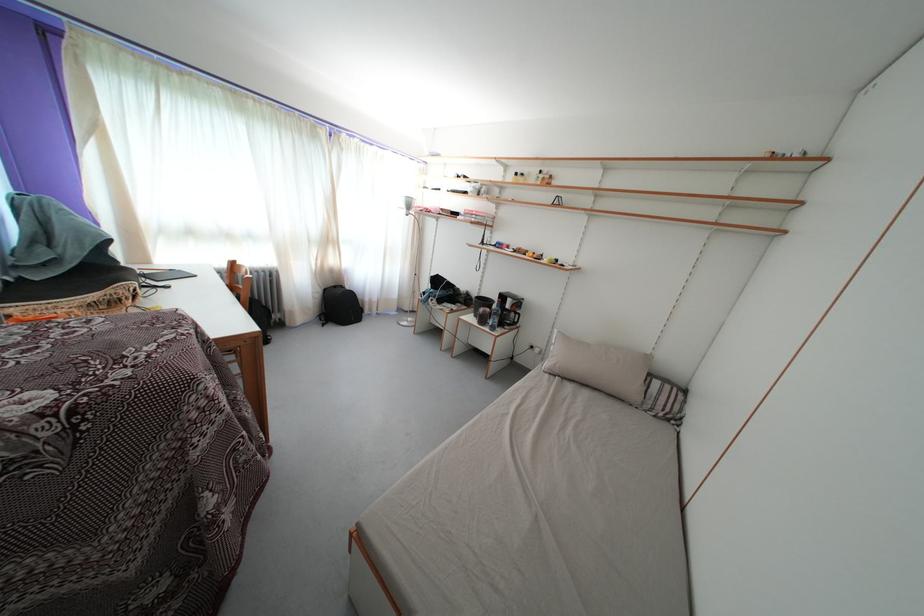
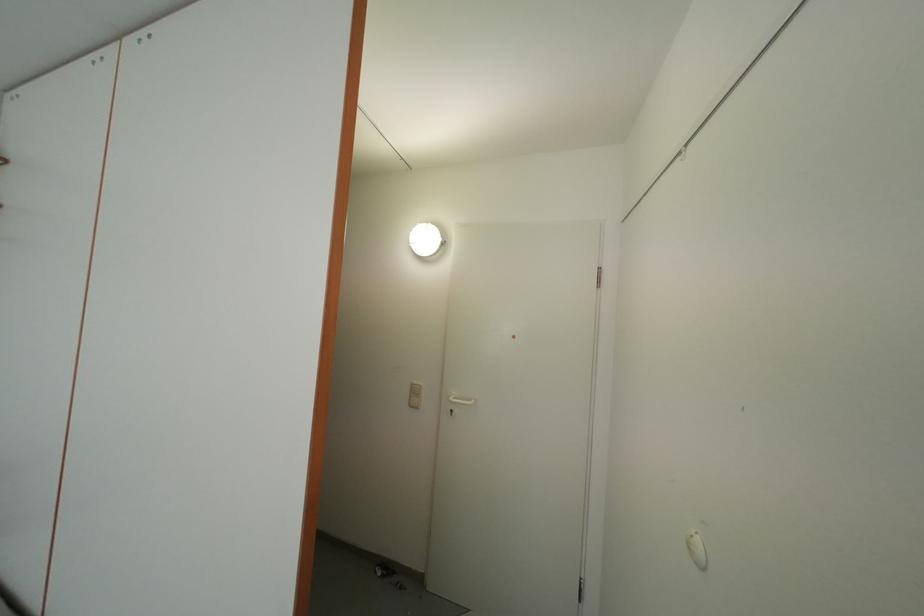
Question: The camera is either moving clockwise (left) or counter-clockwise (right) around the object. The first image is from the beginning of the video and the second image is from the end. Is the camera moving left or right when shooting the video?

Choices:
 (A) Left
 (B) Right

Answer: (A)